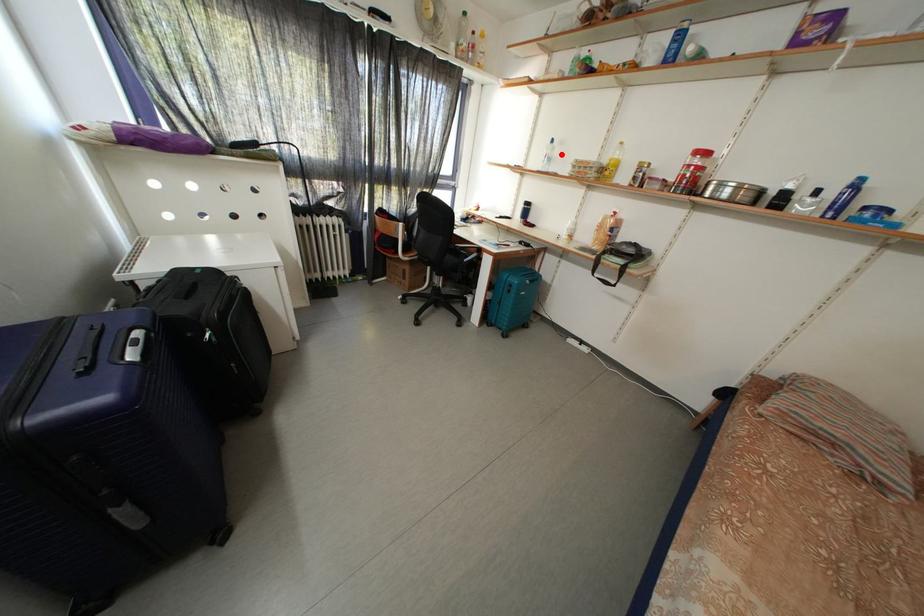
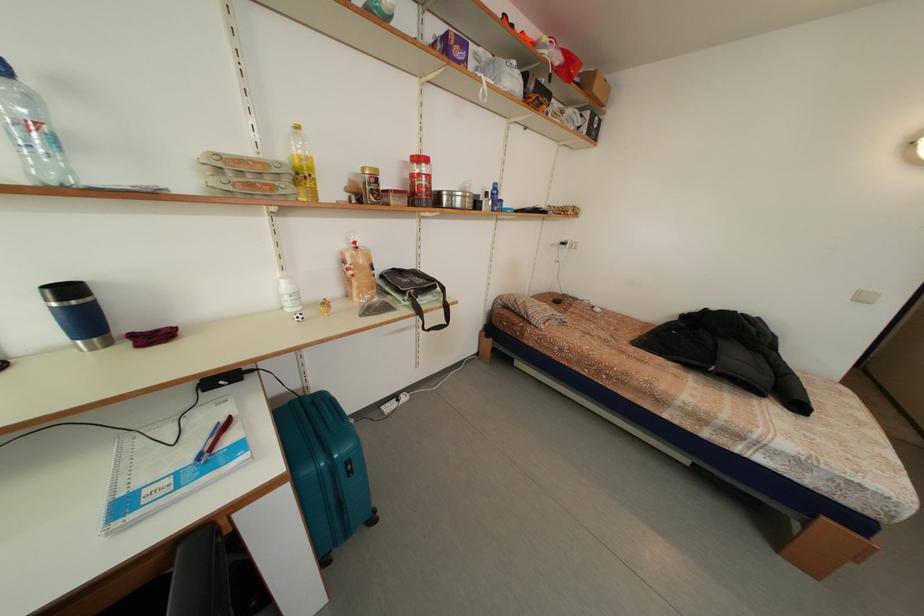
The point at the highlighted location is marked in the first image. Where is the corresponding point in the second image?

(40, 106)